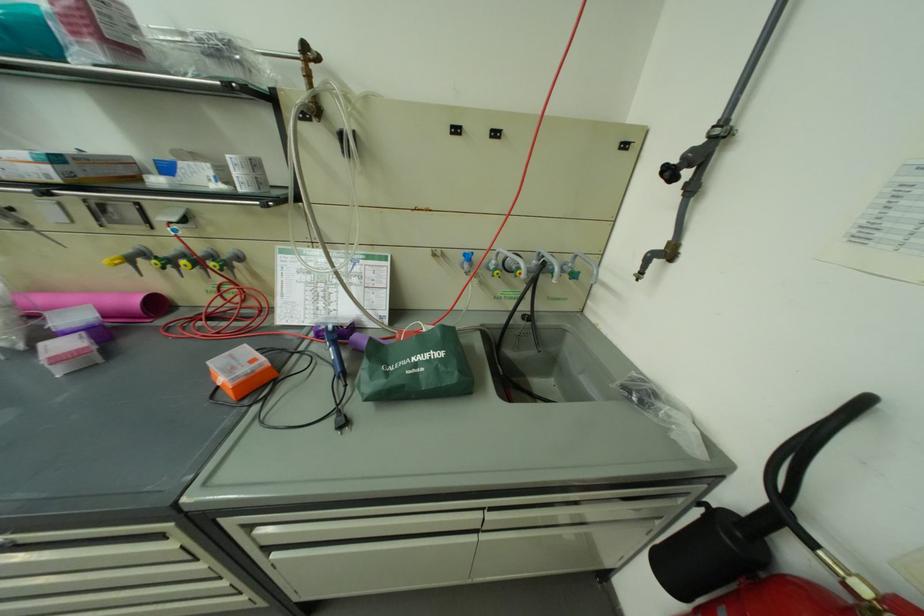
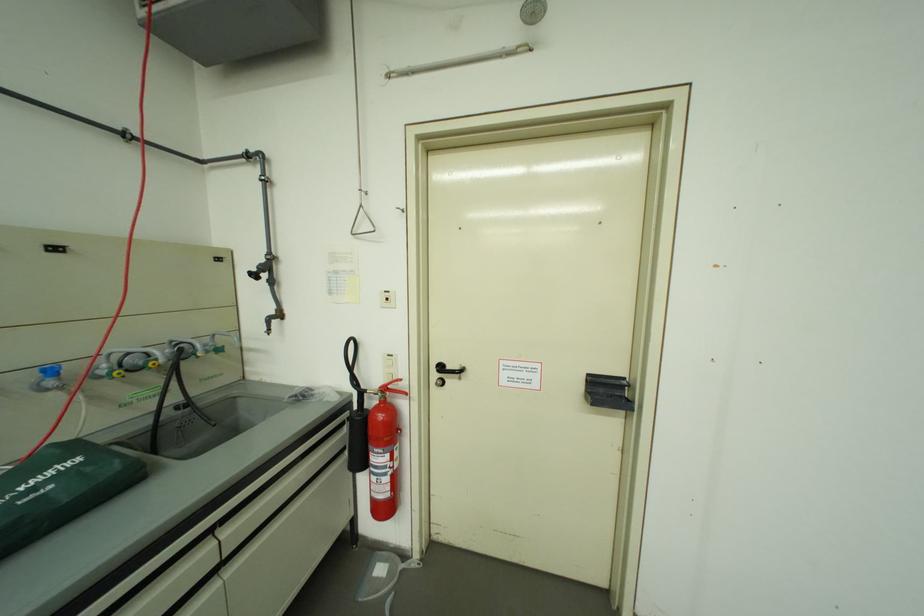
In the second image, find the point that corresponds to pixel 502 268 in the first image.

(113, 374)